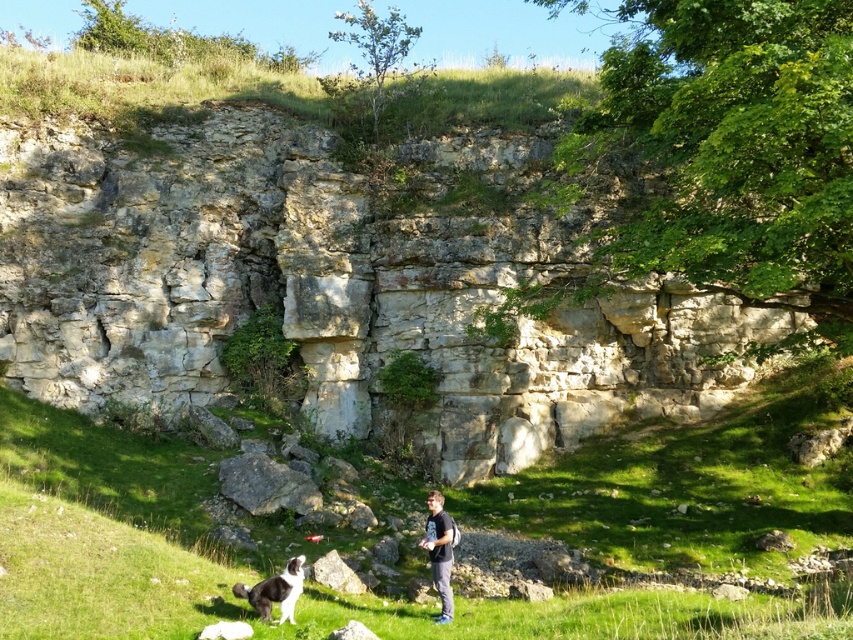
You are standing in the grassy area of the cliff scene and want to move from point A to point B. Point A is at coordinates point (291, 552) and point B is at coordinates point (451, 561). Which point is closer to you?

Point (291, 552) is closer to you because it is further to the viewer than point (451, 561).